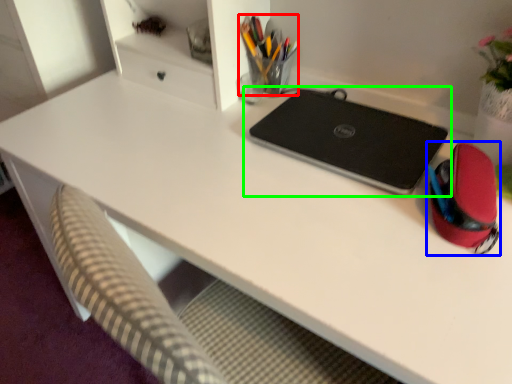
Question: Considering the real-world distances, which object is closest to stationery (highlighted by a red box)? stationery (highlighted by a blue box) or laptop (highlighted by a green box).

Choices:
 (A) stationery
 (B) laptop

Answer: (B)